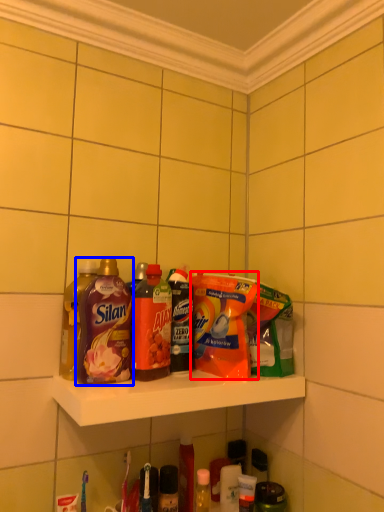
Question: Among these objects, which one is nearest to the camera, cleaning product (highlighted by a red box) or bottle (highlighted by a blue box)?

Choices:
 (A) cleaning product
 (B) bottle

Answer: (B)